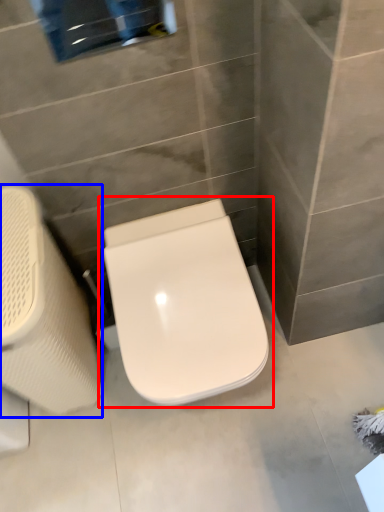
Question: Which of the following is the farthest to the observer, toilet (highlighted by a red box) or swivel chair (highlighted by a blue box)?

Choices:
 (A) toilet
 (B) swivel chair

Answer: (A)